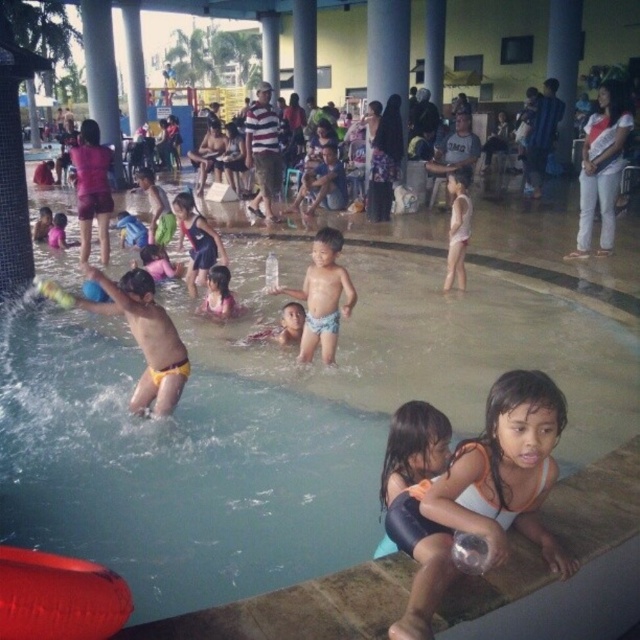
You are a parent at the indoor water park and see the yellow swim trunks at left and the smooth skin child at center. Which object is positioned higher up in the image?

The yellow swim trunks at left is located above the smooth skin child at center, so the yellow swim trunks at left is positioned higher up in the image.

You are a photographer standing at the edge of the pool. You want to take a photo of the matte pink swimsuit at center. Where should you position your camera to capture it in the frame?

The matte pink swimsuit at center is located at coordinates 0.459 on the x axis and 0.342 on the y axis, so position the camera directly facing those coordinates to capture it in the frame.